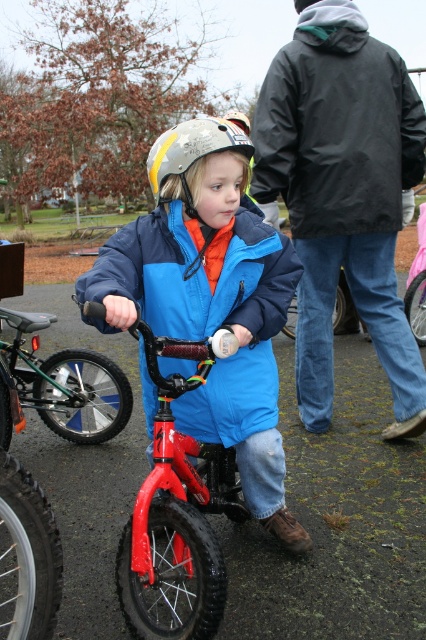
Does point (348, 228) come behind point (8, 362)?

No, (348, 228) is in front of (8, 362).

Is dark gray/waterproof jacket at upper center below red matte bicycle at center?

Actually, dark gray/waterproof jacket at upper center is above red matte bicycle at center.

The image size is (426, 640). What do you see at coordinates (336, 128) in the screenshot? I see `dark gray/waterproof jacket at upper center` at bounding box center [336, 128].

Locate an element on the screen. The height and width of the screenshot is (640, 426). dark gray/waterproof jacket at upper center is located at coordinates (336, 128).

Can you confirm if dark gray/waterproof jacket at upper center is thinner than shiny red bicycle at center?

No.

Can you confirm if dark gray/waterproof jacket at upper center is positioned to the left of shiny red bicycle at center?

Incorrect, dark gray/waterproof jacket at upper center is not on the left side of shiny red bicycle at center.

Where is `dark gray/waterproof jacket at upper center`? The image size is (426, 640). dark gray/waterproof jacket at upper center is located at coordinates tap(336, 128).

Does matte blue jacket at center have a lesser width compared to matte yellow and gray helmet at center?

Incorrect, matte blue jacket at center's width is not less than matte yellow and gray helmet at center's.

Image resolution: width=426 pixels, height=640 pixels. Find the location of `matte blue jacket at center`. matte blue jacket at center is located at coordinates (210, 298).

Image resolution: width=426 pixels, height=640 pixels. In order to click on matte blue jacket at center in this screenshot , I will do `click(210, 298)`.